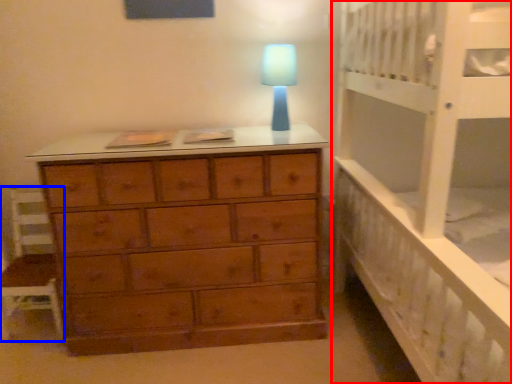
Question: Which object is closer to the camera taking this photo, bed (highlighted by a red box) or chair (highlighted by a blue box)?

Choices:
 (A) bed
 (B) chair

Answer: (A)